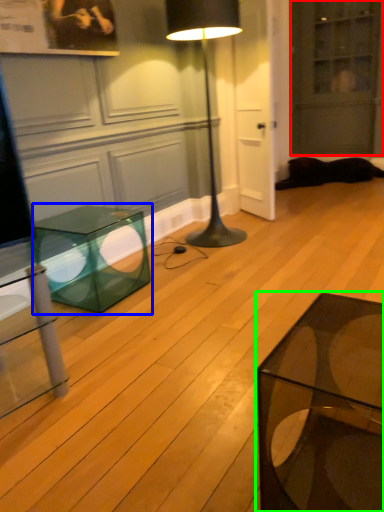
Question: Considering the real-world distances, which object is farthest from glass door (highlighted by a red box)? table (highlighted by a blue box) or coffee table (highlighted by a green box)?

Choices:
 (A) table
 (B) coffee table

Answer: (B)